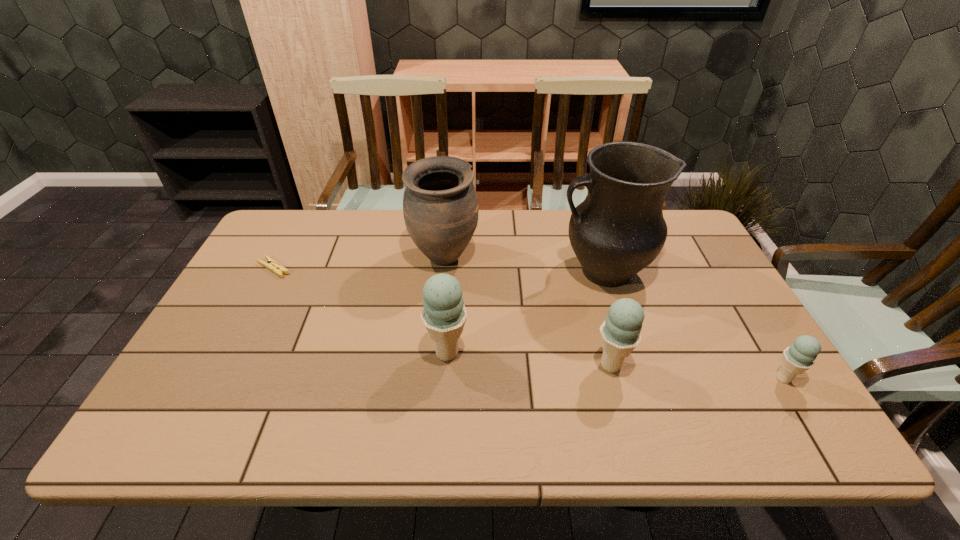
Where is `free space located 0.080m on the back of the second ice cream from right to left`? This screenshot has width=960, height=540. free space located 0.080m on the back of the second ice cream from right to left is located at coordinates (600, 326).

This screenshot has width=960, height=540. I want to click on free location located on the left of the rightmost object, so click(x=672, y=379).

At what (x,y) coordinates should I click in order to perform the action: click on free region located on the handle side of the tallest object. Please return your answer as a coordinate pair (x, y). Looking at the image, I should click on (448, 272).

The image size is (960, 540). In order to click on vacant space located on the handle side of the tallest object in this screenshot , I will do `click(432, 272)`.

Where is `free point located on the handle side of the tallest object`? Image resolution: width=960 pixels, height=540 pixels. free point located on the handle side of the tallest object is located at coordinates (452, 272).

At what (x,y) coordinates should I click in order to perform the action: click on vacant region located on the right of the urn. Please return your answer as a coordinate pair (x, y). Looking at the image, I should click on pyautogui.click(x=531, y=259).

In order to click on free spot located on the right of the shortest object in this screenshot , I will do `click(362, 268)`.

Identify the location of pitcher that is at the far edge. 618,230.

Where is `urn present at the far edge`? urn present at the far edge is located at coordinates (440, 206).

Where is `object positioned at the left edge`? object positioned at the left edge is located at coordinates (272, 265).